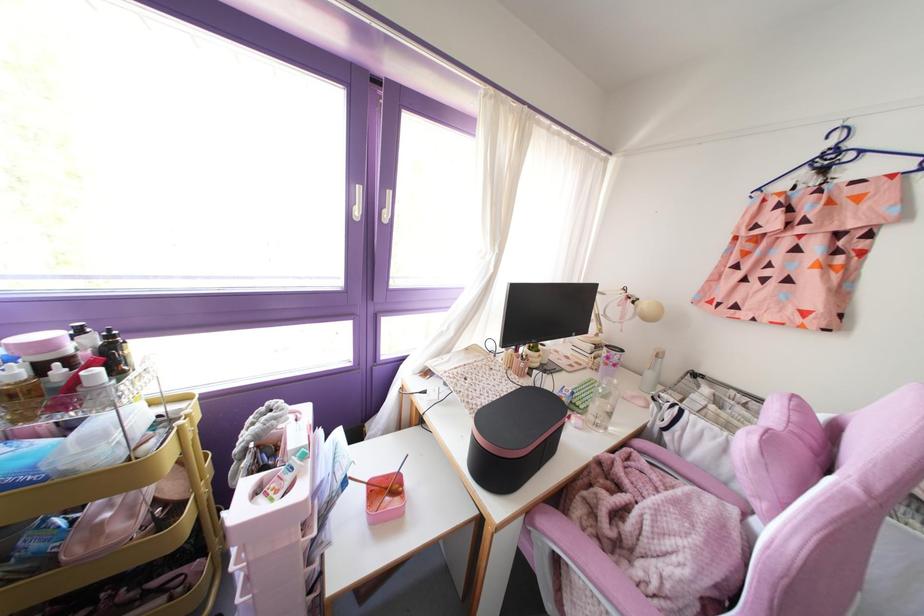
At what (x,y) coordinates should I click in order to perform the action: click on white bottle pump. Please return your answer as a coordinate pair (x, y). This screenshot has height=616, width=924. Looking at the image, I should click on (651, 371).